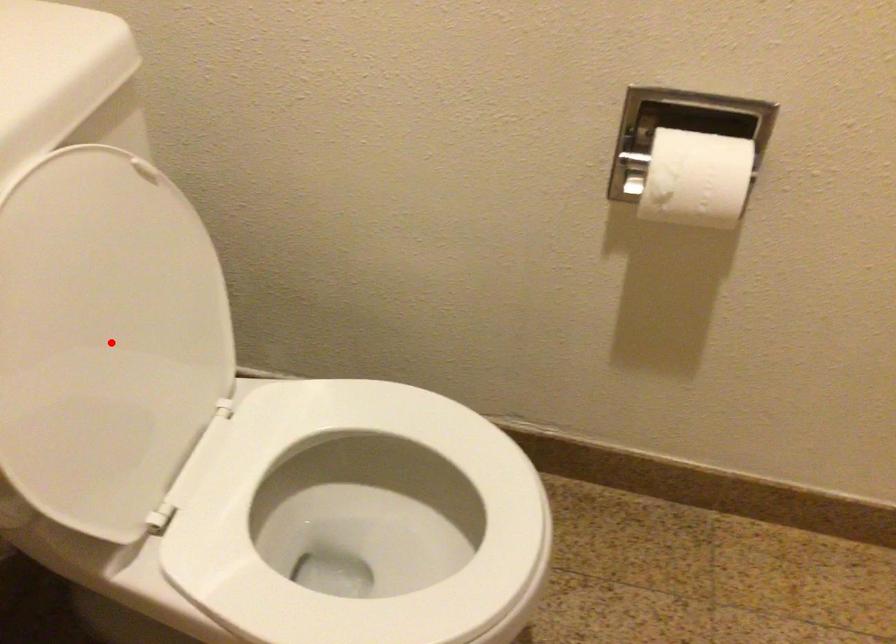
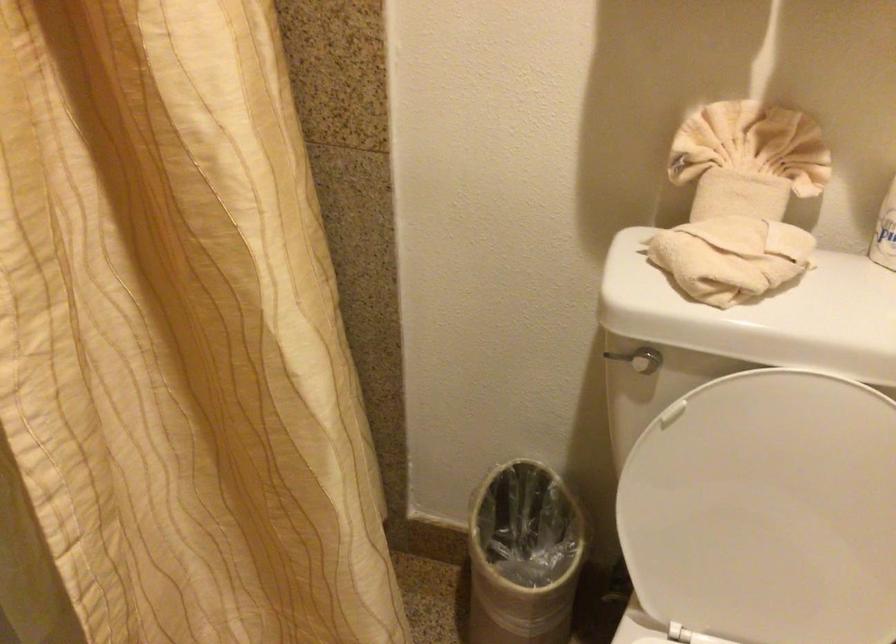
Question: I am providing you with two images of the same scene from different viewpoints. Given a red point in image1, look at the same physical point in image2. Is it:

Choices:
 (A) Closer to the viewpoint
 (B) Farther from the viewpoint

Answer: (B)